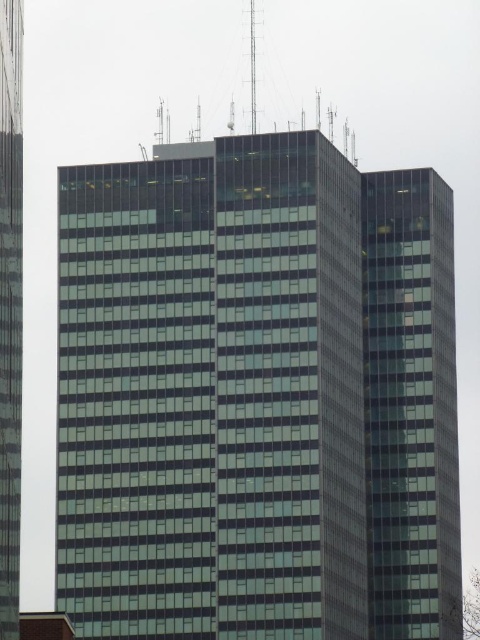
Is point (443, 540) positioned in front of point (4, 628)?

That is False.

Does green glass building at center appear on the left side of transparent glass building at left?

No, green glass building at center is not to the left of transparent glass building at left.

Identify the location of green glass building at center. The height and width of the screenshot is (640, 480). (256, 396).